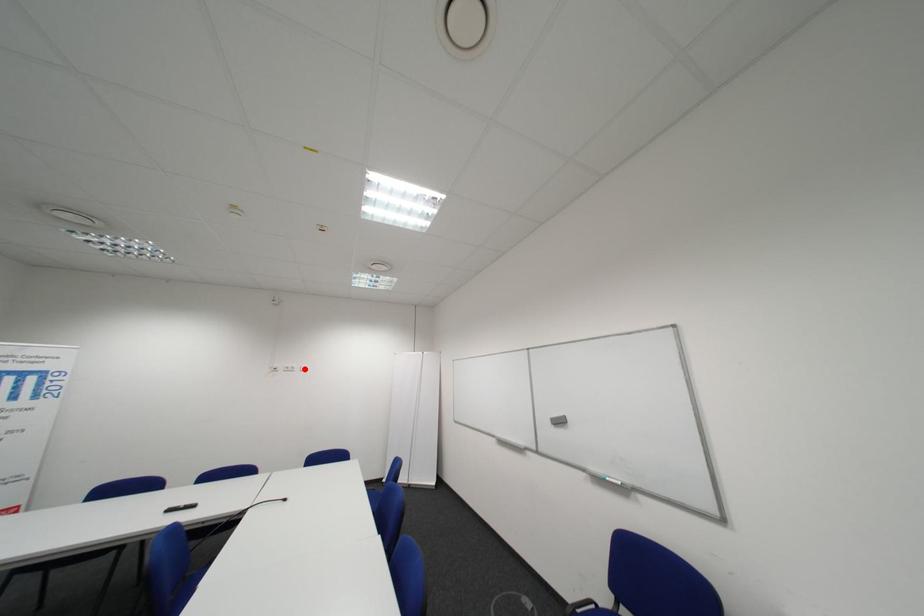
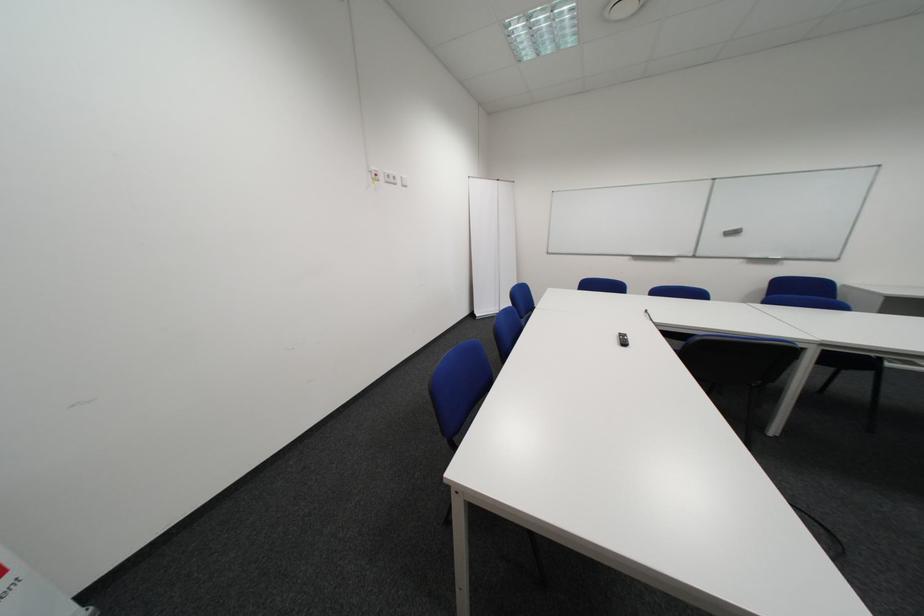
Where in the second image is the point corresponding to the highlighted location from the first image?

(407, 179)